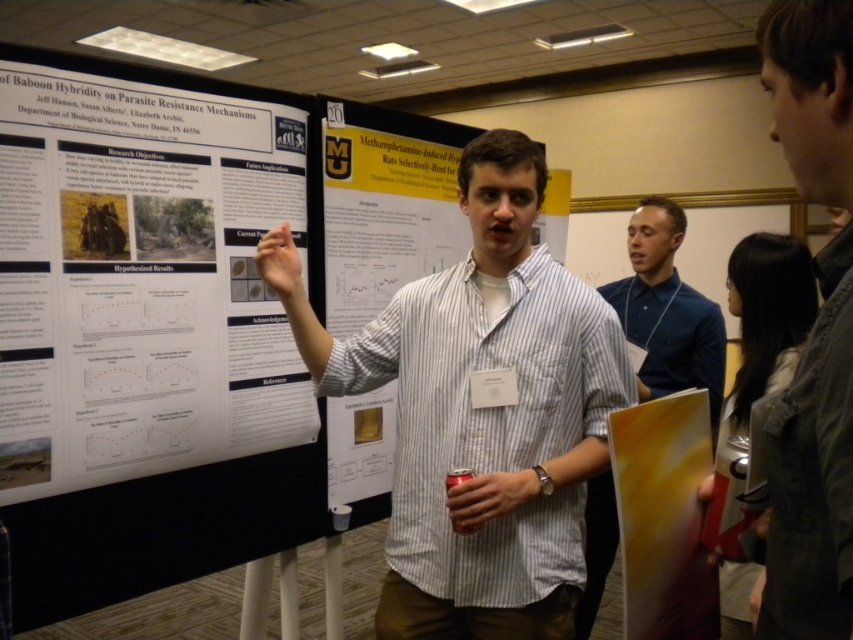
Question: Which of the following is the farthest from the observer?

Choices:
 (A) white striped shirt at center
 (B) striped cotton shirt at center
 (C) gray denim jacket at upper right

Answer: (A)

Question: In this image, where is white paper poster at left located relative to blue fabric shirt at center?

Choices:
 (A) below
 (B) above

Answer: (B)

Question: Can you confirm if gray denim jacket at upper right is bigger than blue fabric shirt at center?

Choices:
 (A) yes
 (B) no

Answer: (B)

Question: Which object is positioned farthest from the striped cotton shirt at center?

Choices:
 (A) blue fabric shirt at center
 (B) white striped shirt at center
 (C) gray denim jacket at upper right
 (D) white paper poster at left

Answer: (A)

Question: From the image, what is the correct spatial relationship of white paper poster at left in relation to gray denim jacket at upper right?

Choices:
 (A) left
 (B) right

Answer: (A)

Question: Among these objects, which one is nearest to the camera?

Choices:
 (A) gray denim jacket at upper right
 (B) striped cotton shirt at center
 (C) white striped shirt at center

Answer: (A)